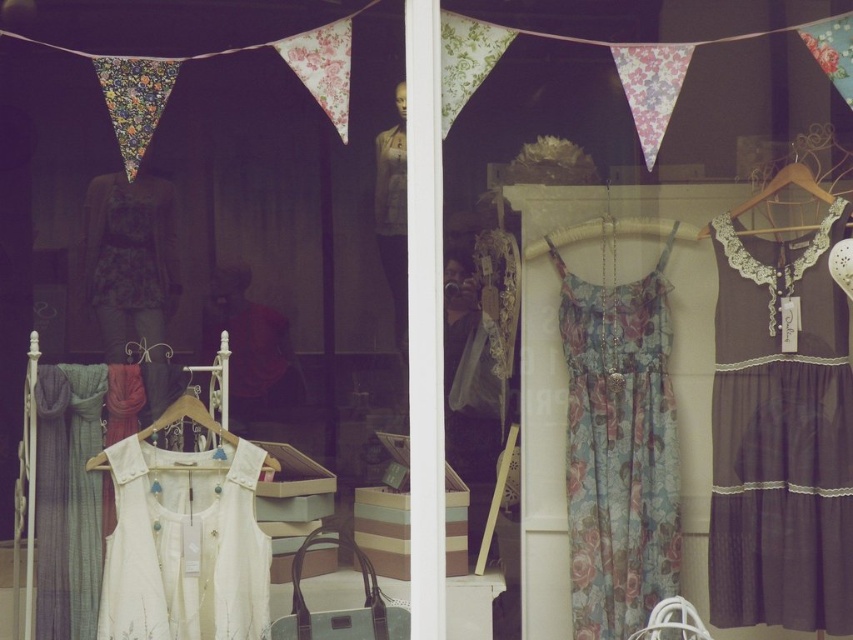
Question: Which object is positioned farthest from the wooden hanger at upper right?

Choices:
 (A) white cotton vest at lower left
 (B) floral chiffon dress at center
 (C) floral fabric dress at center

Answer: (C)

Question: Among these points, which one is nearest to the camera?

Choices:
 (A) (772, 188)
 (B) (148, 337)
 (C) (350, 17)
 (D) (231, 445)

Answer: (C)

Question: Which point is farther to the camera?

Choices:
 (A) (260, 44)
 (B) (645, 465)

Answer: (A)

Question: Considering the relative positions of white cotton vest at lower left and white fabric hanger at center in the image provided, where is white cotton vest at lower left located with respect to white fabric hanger at center?

Choices:
 (A) below
 (B) above

Answer: (A)

Question: Can you confirm if floral chiffon dress at center is positioned below floral fabric dress at center?

Choices:
 (A) yes
 (B) no

Answer: (A)

Question: Does dark gray lace dress at right have a greater width compared to matte white dress at center?

Choices:
 (A) yes
 (B) no

Answer: (B)